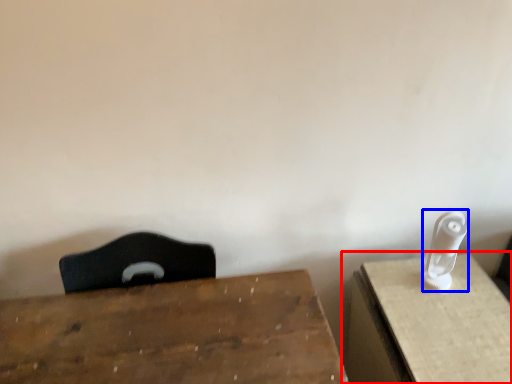
Question: Which object appears farthest to the camera in this image, table (highlighted by a red box) or Wii controller (highlighted by a blue box)?

Choices:
 (A) table
 (B) Wii controller

Answer: (B)